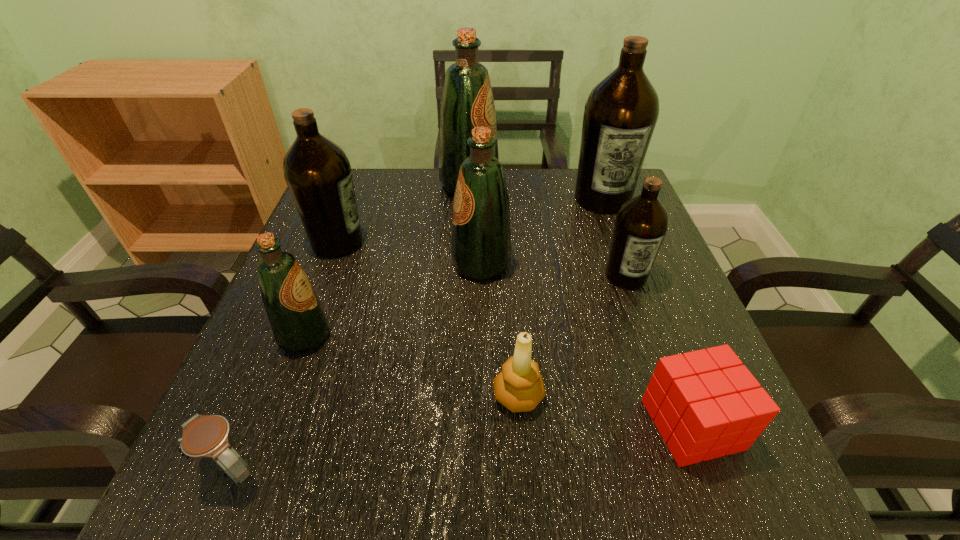
Locate an element on the screen. blank space located 0.050m on the front of the cube is located at coordinates (722, 505).

At what (x,y) coordinates should I click in order to perform the action: click on free space located 0.400m on the back of the gray watch. Please return your answer as a coordinate pair (x, y). Image resolution: width=960 pixels, height=540 pixels. Looking at the image, I should click on (317, 264).

I want to click on cube that is at the near edge, so [x=705, y=404].

This screenshot has height=540, width=960. What are the coordinates of `watch located in the near edge section of the desktop` in the screenshot? It's located at (204, 436).

I want to click on watch that is at the left edge, so click(204, 436).

What are the coordinates of `cube present at the right edge` in the screenshot? It's located at (705, 404).

The image size is (960, 540). What are the coordinates of `object that is at the near left corner` in the screenshot? It's located at (204, 436).

Locate an element on the screen. The width and height of the screenshot is (960, 540). object present at the far right corner is located at coordinates (620, 115).

I want to click on object present at the near right corner, so click(705, 404).

At what (x,y) coordinates should I click in order to perform the action: click on free location at the far edge. Please return your answer as a coordinate pair (x, y). The width and height of the screenshot is (960, 540). Looking at the image, I should click on (415, 214).